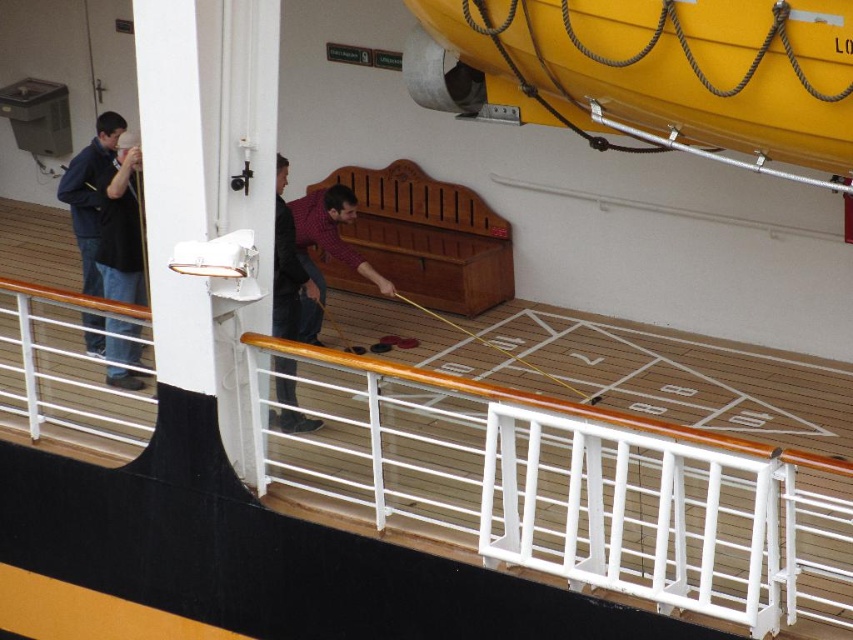
You are standing on the deck of a ship playing shuffleboard. You notice two points marked on the deck at coordinates point [120,241] and point [277,227]. If you want to move from the first point to the second point without crossing the shuffleboard table, which direction should you go?

You should move forward because point [120,241] is behind point [277,227], so moving forward would take you towards the second point without crossing the shuffleboard table.